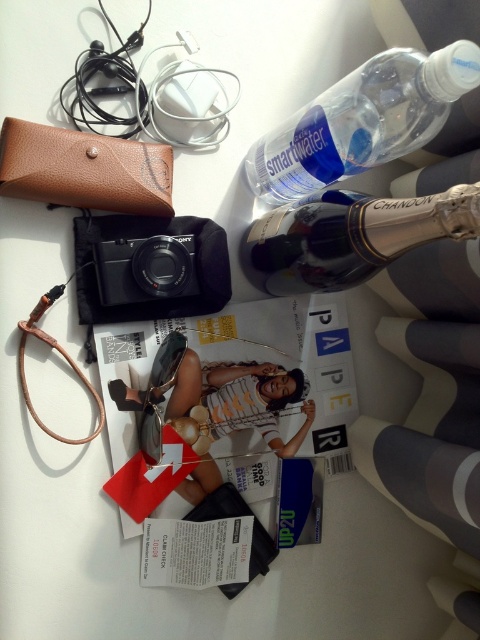
You are organizing items on a table and need to place a new item between the matte paper magazine at center and the black matte camera at center. Since the magazine is taller than the camera, where should you place the new item to maintain a descending height order from left to right?

Place the new item to the right of the matte paper magazine at center and to the left of the black matte camera at center, ensuring it is shorter than the magazine but taller than the camera to maintain the descending height order.

You are organizing a photography exhibition and need to place the matte paper magazine at center and the black matte camera at center on a display table. According to the scene, which object should be placed to the left to maintain the original arrangement?

The black matte camera at center should be placed to the left because the matte paper magazine at center is to the right of it in the original arrangement.